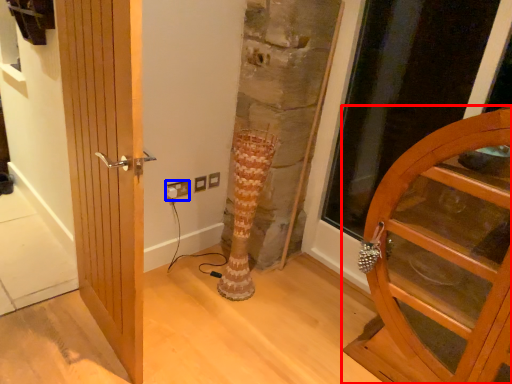
Question: Which of the following is the farthest to the observer, door (highlighted by a red box) or electric outlet (highlighted by a blue box)?

Choices:
 (A) door
 (B) electric outlet

Answer: (B)